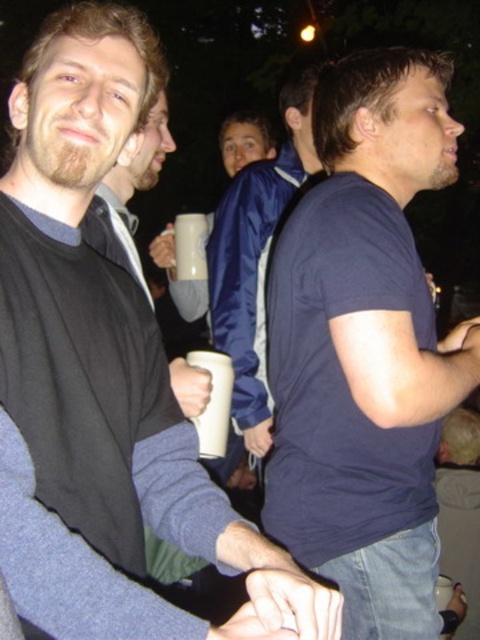
Is dark blue t-shirt at center to the left of white matte cup at center from the viewer's perspective?

Incorrect, dark blue t-shirt at center is not on the left side of white matte cup at center.

Does dark blue t-shirt at center have a larger size compared to white matte cup at center?

Yes, dark blue t-shirt at center is bigger than white matte cup at center.

Which is in front, point (371, 602) or point (223, 353)?

Point (371, 602) is in front.

This screenshot has height=640, width=480. I want to click on dark blue t-shirt at center, so click(x=365, y=346).

Which is more to the left, dark blue t-shirt at center or matte black jacket at left?

Positioned to the left is matte black jacket at left.

Can you confirm if dark blue t-shirt at center is thinner than matte black jacket at left?

No, dark blue t-shirt at center is not thinner than matte black jacket at left.

Does point (414, 64) lie behind point (109, 198)?

No, it is not.

Where is `dark blue t-shirt at center`? dark blue t-shirt at center is located at coordinates (365, 346).

Which is above, blue satin jacket at center or white matte mug at center?

white matte mug at center

Consider the image. Is blue satin jacket at center positioned at the back of white matte mug at center?

No.

Find the location of a particular element. The height and width of the screenshot is (640, 480). blue satin jacket at center is located at coordinates (244, 141).

The width and height of the screenshot is (480, 640). I want to click on blue satin jacket at center, so click(x=244, y=141).